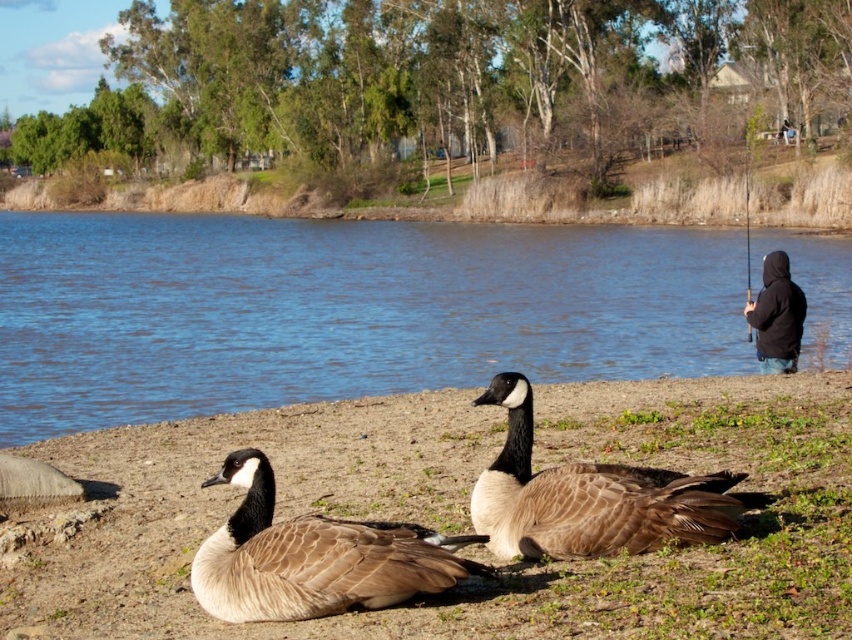
You are standing at the edge of the lake and want to take a photo of the blue water at center. Where should you aim your camera?

You should aim your camera at point 0.487 on the horizontal axis and point 0.400 on the vertical axis to capture the blue water at center.

Based on the photo, you are a wildlife photographer trying to capture a close shot of the geese. You have a camera with a zoom lens that can focus on objects up to 5 meters away. You are currently standing 3 meters away from the brown feathered geese at center and 4 meters away from the brown feathered goose at center. Which goose can you focus on with your current zoom settings?

The brown feathered geese at center is bigger than the brown feathered goose at center, but both are within the 5 meter range. Since the zoom lens can focus up to 5 meters, you can focus on both geese as they are both within the 3 and 4 meter distances respectively.